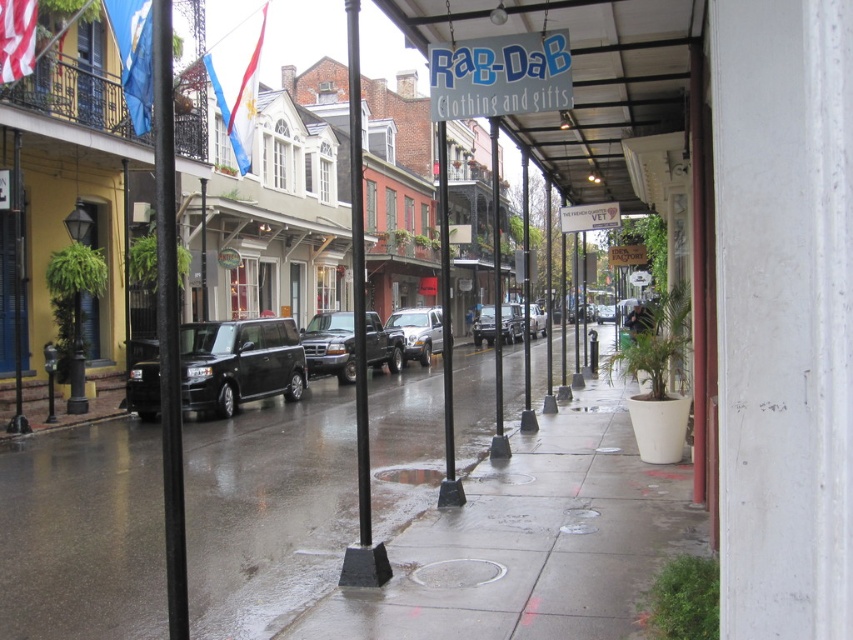
Does black metal pole at center have a lesser width compared to silver metallic truck at center?

No.

Can you confirm if black metal pole at center is positioned above silver metallic truck at center?

Correct, black metal pole at center is located above silver metallic truck at center.

Image resolution: width=853 pixels, height=640 pixels. Identify the location of black metal pole at center. (496, 300).

At what (x,y) coordinates should I click in order to perform the action: click on black metal pole at center. Please return your answer as a coordinate pair (x, y). The image size is (853, 640). Looking at the image, I should click on (496, 300).

Consider the image. Between shiny black suv at left and black plastic pole at center, which one appears on the left side from the viewer's perspective?

shiny black suv at left

Is shiny black suv at left further to the viewer compared to black plastic pole at center?

Yes, it is.

The width and height of the screenshot is (853, 640). Identify the location of shiny black suv at left. (239, 364).

Which is below, glossy concrete sidewalk at center or black plastic pole at center?

glossy concrete sidewalk at center is below.

Measure the distance between glossy concrete sidewalk at center and camera.

glossy concrete sidewalk at center and camera are 16.02 feet apart.

Where is `glossy concrete sidewalk at center`? Image resolution: width=853 pixels, height=640 pixels. glossy concrete sidewalk at center is located at coordinates (267, 509).

Where is `glossy concrete sidewalk at center`? glossy concrete sidewalk at center is located at coordinates (267, 509).